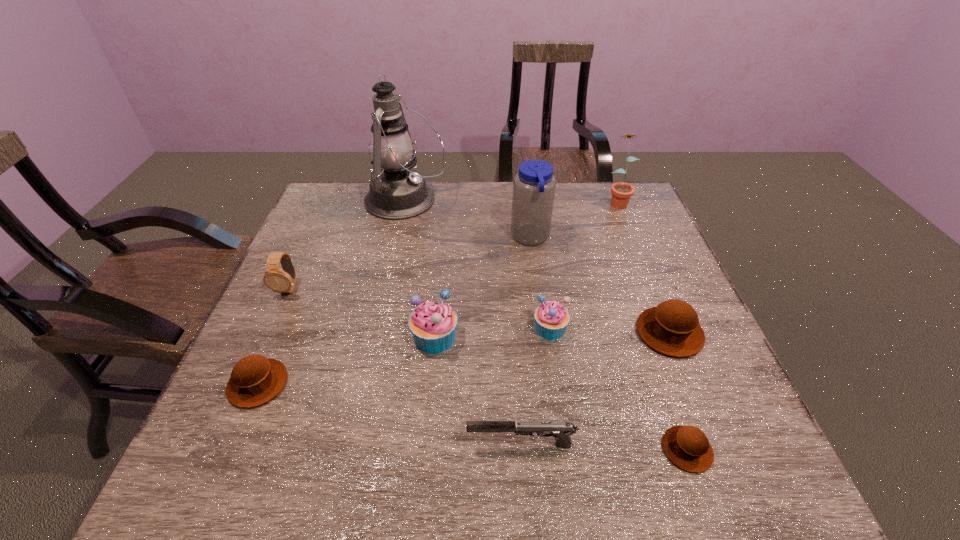
Locate an element on the screen. sunflower that is at the far edge is located at coordinates (621, 192).

I want to click on water bottle at the far edge, so click(x=534, y=186).

I want to click on gun located in the near edge section of the desktop, so click(x=561, y=431).

The height and width of the screenshot is (540, 960). What are the coordinates of `muffin situated at the near edge` in the screenshot? It's located at (687, 447).

Locate an element on the screen. oil lamp at the left edge is located at coordinates (396, 192).

At what (x,y) coordinates should I click in order to perform the action: click on watch at the left edge. Please return your answer as a coordinate pair (x, y). The width and height of the screenshot is (960, 540). Looking at the image, I should click on (281, 281).

You are a GUI agent. You are given a task and a screenshot of the screen. Output one action in this format:
    pyautogui.click(x=<x>, y=<y>)
    Task: Click on the muffin situated at the left edge
    This screenshot has height=540, width=960.
    Given the screenshot: What is the action you would take?
    pyautogui.click(x=255, y=380)

You are a GUI agent. You are given a task and a screenshot of the screen. Output one action in this format:
    pyautogui.click(x=<x>, y=<y>)
    Task: Click on the sunflower located in the right edge section of the desktop
    The height and width of the screenshot is (540, 960).
    Given the screenshot: What is the action you would take?
    pyautogui.click(x=621, y=192)

Find the location of a particular element. object located in the far left corner section of the desktop is located at coordinates (396, 192).

Where is `object located at the far right corner`? The width and height of the screenshot is (960, 540). object located at the far right corner is located at coordinates (621, 192).